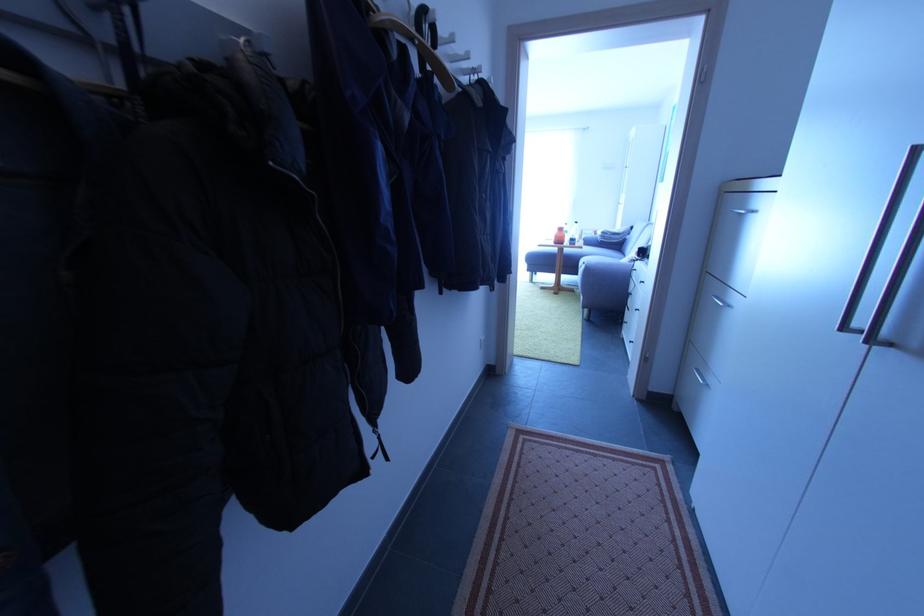
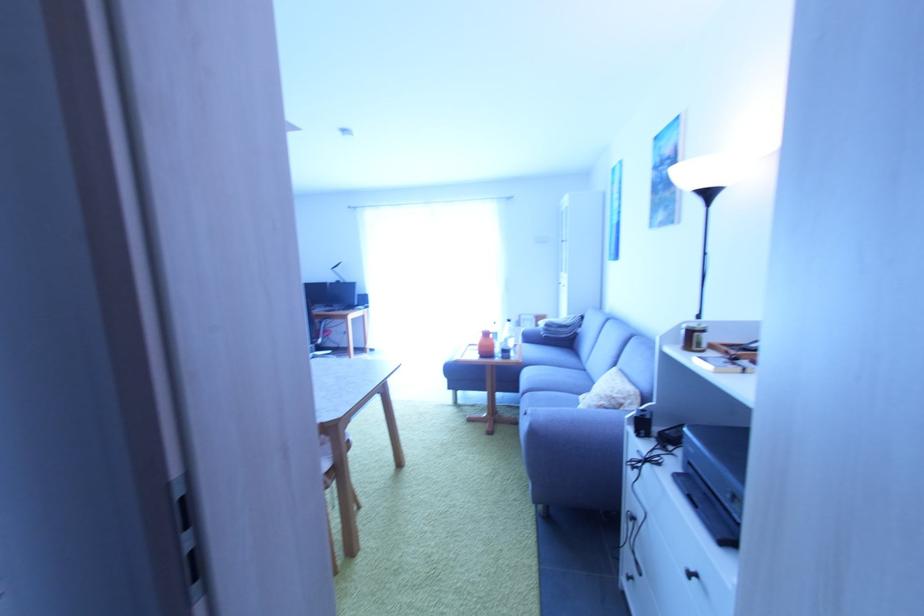
Question: I am providing you with two images of the same scene from different viewpoints. Please identify which objects are invisible in image2.

Choices:
 (A) clear water bottle
 (B) sofa armrest
 (C) orange bottle
 (D) none of these

Answer: (D)